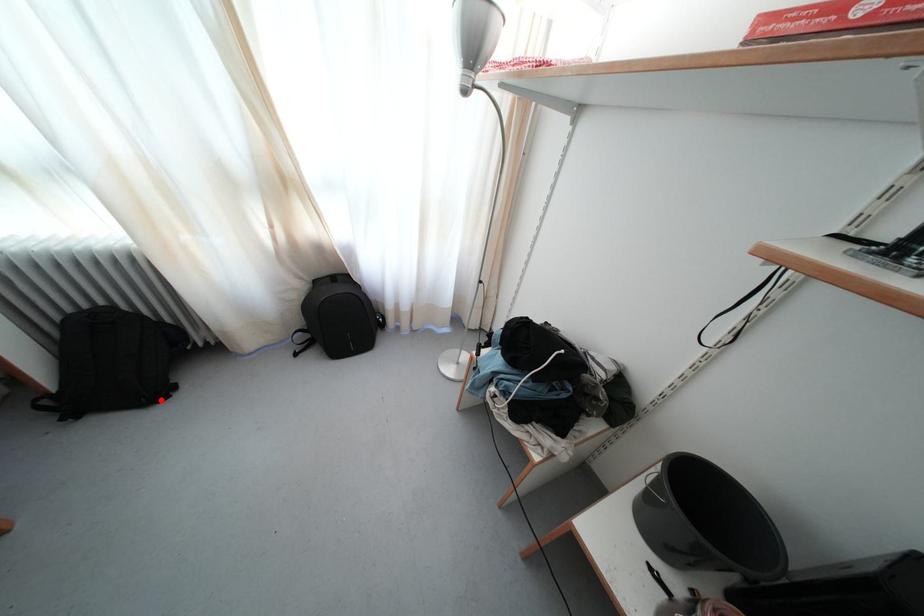
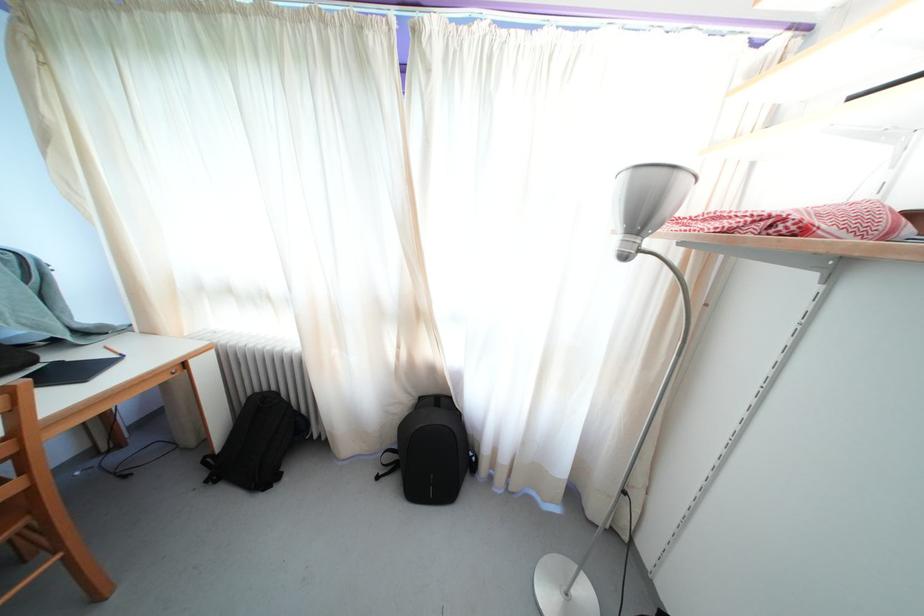
The point at the highlighted location is marked in the first image. Where is the corresponding point in the second image?

(271, 485)